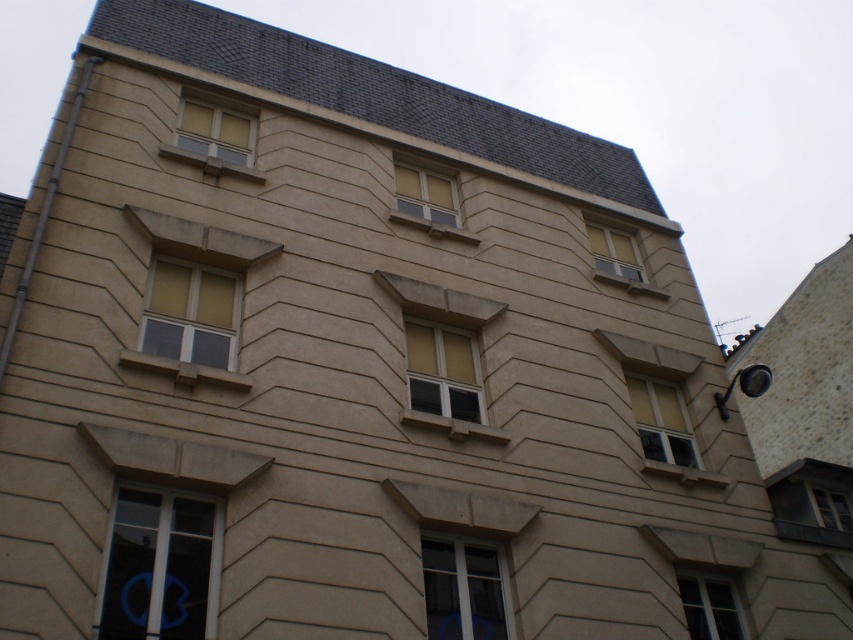
You are standing in front of the residential building and notice two windows at the lower right side. Which one is positioned more to the right between the matte gray window at lower right and the matte glass window at lower right?

The matte gray window at lower right is positioned more to the right than the matte glass window at lower right according to the description.

You are a maintenance worker who needs to replace a window. You are standing at the base of the building and looking up. Which window is closer to you, the matte glass window at lower right or the yellow matte window at upper center?

The matte glass window at lower right is closer to you because it is only 12.53 meters away from the yellow matte window at upper center, so the lower one is nearer.

You are standing in front of the residential building and want to know which window is nearer to you. The options are the matte glass window at lower right and the yellow matte window at upper center. Which one is closer?

The matte glass window at lower right is closer to the viewer than the yellow matte window at upper center.